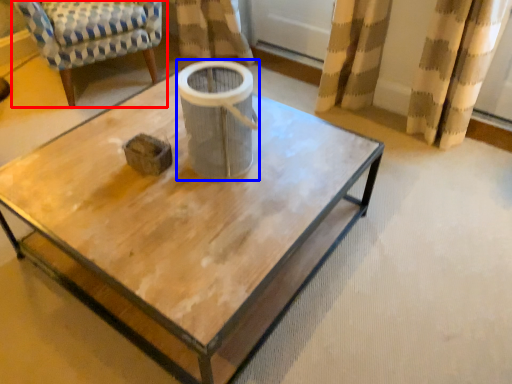
Question: Which object appears farthest to the camera in this image, chair (highlighted by a red box) or gray (highlighted by a blue box)?

Choices:
 (A) chair
 (B) gray

Answer: (A)